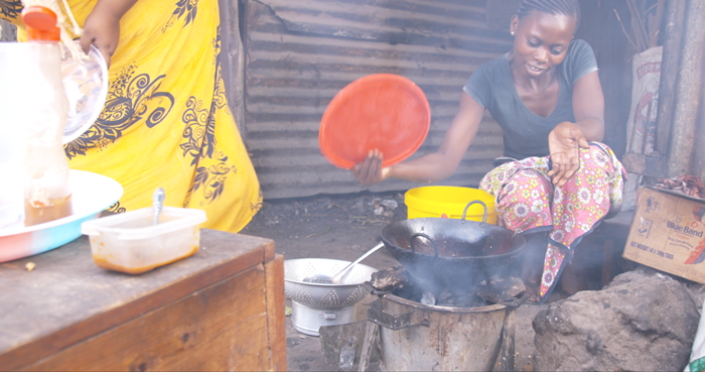
Locate an element on the screen. Image resolution: width=705 pixels, height=372 pixels. yellow bucket is located at coordinates (436, 197).